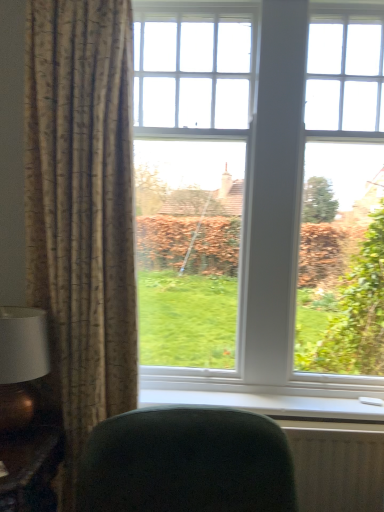
Question: Is white plastic window sill at lower center taller than wooden table at lower left?

Choices:
 (A) no
 (B) yes

Answer: (A)

Question: Is wooden table at lower left located within white plastic window sill at lower center?

Choices:
 (A) yes
 (B) no

Answer: (B)

Question: Is white plastic window sill at lower center at the right side of wooden table at lower left?

Choices:
 (A) no
 (B) yes

Answer: (B)

Question: Is white plastic window sill at lower center positioned far away from wooden table at lower left?

Choices:
 (A) no
 (B) yes

Answer: (A)

Question: Is white plastic window sill at lower center facing away from wooden table at lower left?

Choices:
 (A) yes
 (B) no

Answer: (B)

Question: From the image's perspective, relative to white plastic window sill at lower center, is white textured radiator at lower right above or below?

Choices:
 (A) above
 (B) below

Answer: (B)

Question: Choose the correct answer: Is white textured radiator at lower right inside white plastic window sill at lower center or outside it?

Choices:
 (A) inside
 (B) outside

Answer: (B)

Question: In the image, is white textured radiator at lower right positioned in front of or behind white plastic window sill at lower center?

Choices:
 (A) front
 (B) behind

Answer: (A)

Question: Looking at the image, does white textured radiator at lower right seem bigger or smaller compared to white plastic window sill at lower center?

Choices:
 (A) big
 (B) small

Answer: (A)

Question: Visually, is matte gold table lamp at left positioned to the left or to the right of textured beige curtain at left?

Choices:
 (A) right
 (B) left

Answer: (B)

Question: From the image's perspective, is matte gold table lamp at left above or below textured beige curtain at left?

Choices:
 (A) below
 (B) above

Answer: (A)

Question: Looking at the image, does matte gold table lamp at left seem bigger or smaller compared to textured beige curtain at left?

Choices:
 (A) big
 (B) small

Answer: (B)

Question: Is matte gold table lamp at left in front of or behind textured beige curtain at left in the image?

Choices:
 (A) behind
 (B) front

Answer: (B)

Question: From the image's perspective, is white plastic window sill at lower center located above or below dark green fabric chair at lower center?

Choices:
 (A) below
 (B) above

Answer: (B)

Question: Looking at the image, does white plastic window sill at lower center seem bigger or smaller compared to dark green fabric chair at lower center?

Choices:
 (A) big
 (B) small

Answer: (B)